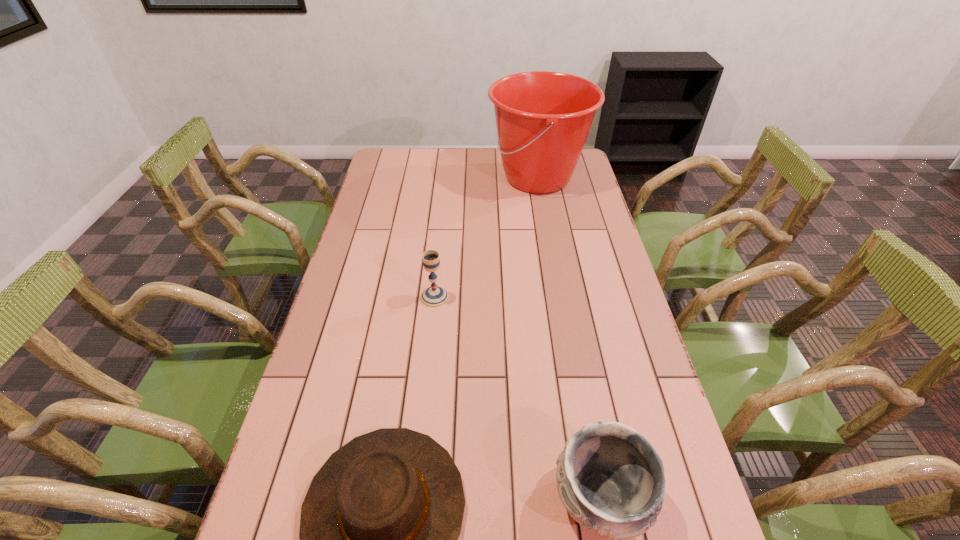
The image size is (960, 540). What are the coordinates of `the tallest object` in the screenshot? It's located at (543, 118).

This screenshot has width=960, height=540. I want to click on the farthest object, so click(x=543, y=118).

The height and width of the screenshot is (540, 960). Find the location of `the third nearest object`. the third nearest object is located at coordinates (434, 296).

The image size is (960, 540). Identify the location of free space located 0.090m with the handle attached to the rim of the bucket. tap(466, 178).

Where is `vacant area situated 0.100m with the handle attached to the rim of the bucket`? Image resolution: width=960 pixels, height=540 pixels. vacant area situated 0.100m with the handle attached to the rim of the bucket is located at coordinates (463, 178).

Image resolution: width=960 pixels, height=540 pixels. I want to click on vacant space located with the handle attached to the rim of the bucket, so click(x=391, y=178).

Where is `free space located on the front of the third nearest object`? The image size is (960, 540). free space located on the front of the third nearest object is located at coordinates (432, 329).

Where is `object located in the far edge section of the desktop`? This screenshot has width=960, height=540. object located in the far edge section of the desktop is located at coordinates (543, 118).

The height and width of the screenshot is (540, 960). What are the coordinates of `object present at the right edge` in the screenshot? It's located at (543, 118).

At what (x,y) coordinates should I click in order to perform the action: click on object positioned at the far right corner. Please return your answer as a coordinate pair (x, y). Image resolution: width=960 pixels, height=540 pixels. Looking at the image, I should click on (543, 118).